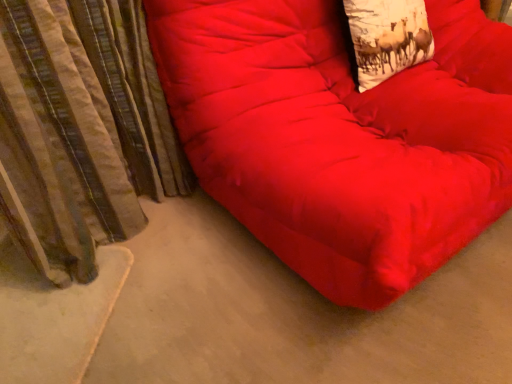
Question: Based on their sizes in the image, would you say matte red beanbag at center is bigger or smaller than striped fabric curtain at left?

Choices:
 (A) small
 (B) big

Answer: (B)

Question: Which is correct: matte red beanbag at center is inside striped fabric curtain at left, or outside of it?

Choices:
 (A) outside
 (B) inside

Answer: (A)

Question: Which is farther from the striped fabric curtain at left?

Choices:
 (A) white cotton throw pillow at upper right
 (B) matte red beanbag at center

Answer: (A)

Question: Which object is the farthest from the matte red beanbag at center?

Choices:
 (A) striped fabric curtain at left
 (B) white cotton throw pillow at upper right

Answer: (A)